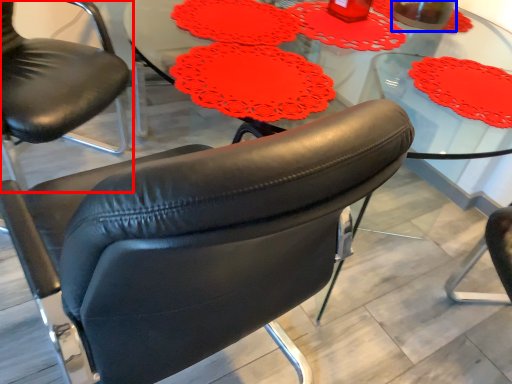
Question: Which object is closer to the camera taking this photo, chair (highlighted by a red box) or beverage (highlighted by a blue box)?

Choices:
 (A) chair
 (B) beverage

Answer: (A)